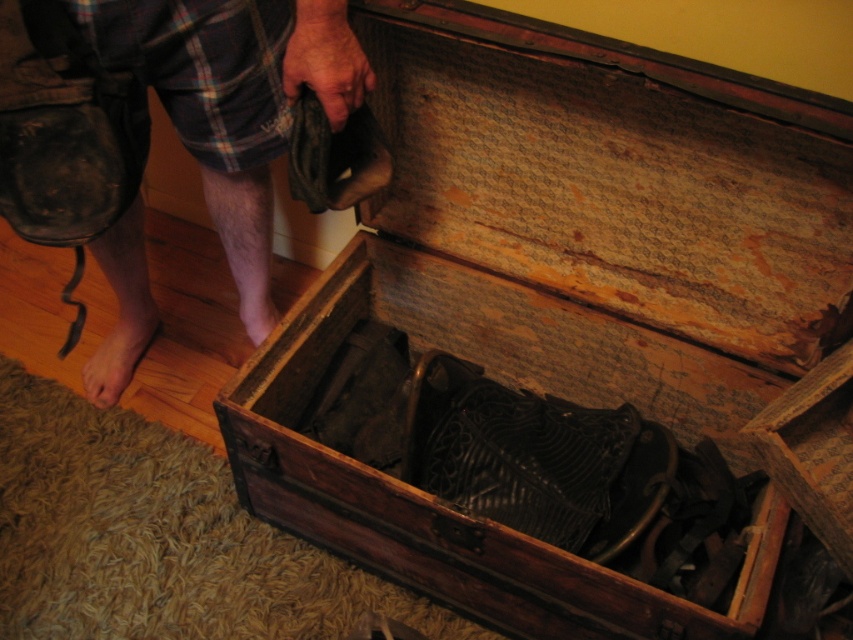
You are a person trying to step onto the wooden trunk at center. Based on the scene, can you safely step onto it without touching the bare skin at lower left?

The wooden trunk at center is in front of the bare skin at lower left, meaning the trunk is closer to you. Since the trunk is in front, you can safely step onto it without touching the bare skin at lower left.

You are trying to place a small decorative item on the floor between the two points marked as point (595, 285) and point (268, 323) in the image. Based on their positions, which point should you place it closer to so that it is in front of both points?

The point (595, 285) is in front of point (268, 323). Therefore, placing the item closer to point (595, 285) would position it in front of both points.